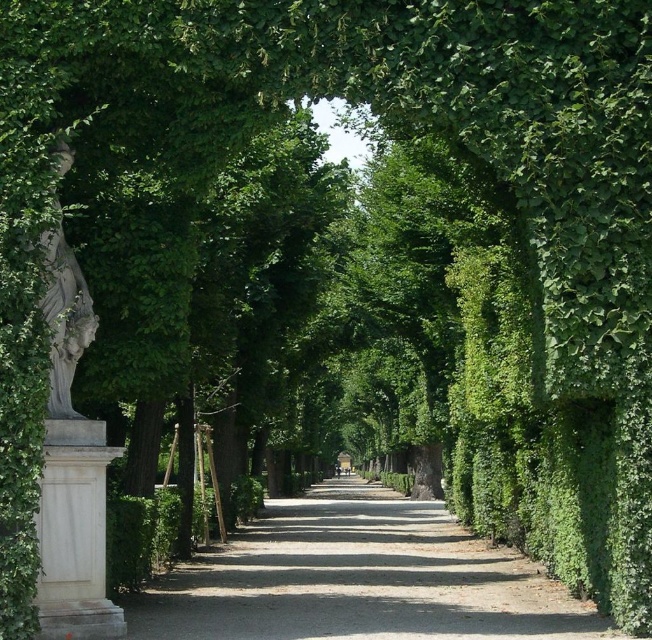
Which of these two, white marble pillar at left or white stone statue at left, stands shorter?

With less height is white marble pillar at left.

Is white marble pillar at left thinner than white stone statue at left?

In fact, white marble pillar at left might be wider than white stone statue at left.

Where is `white marble pillar at left`? This screenshot has height=640, width=652. white marble pillar at left is located at coordinates (74, 532).

Locate an element on the screen. The height and width of the screenshot is (640, 652). white marble pillar at left is located at coordinates (74, 532).